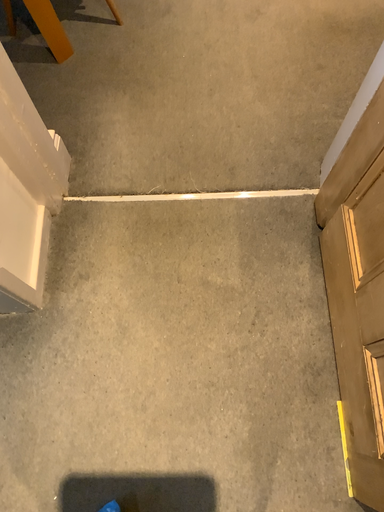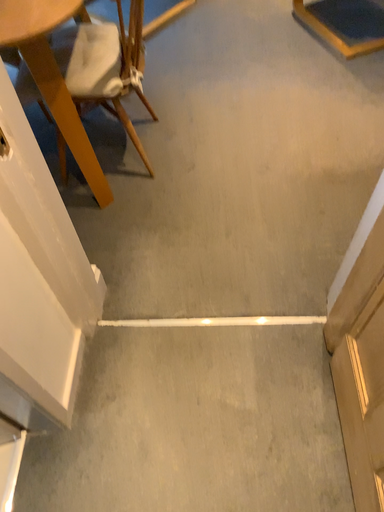
Question: How did the camera likely rotate when shooting the video?

Choices:
 (A) rotated upward
 (B) rotated downward

Answer: (A)